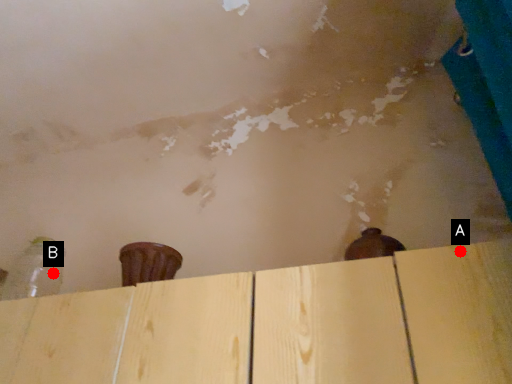
Question: Two points are circled on the image, labeled by A and B beside each circle. Which of the following is the closest to the observer?

Choices:
 (A) A is closer
 (B) B is closer

Answer: (A)